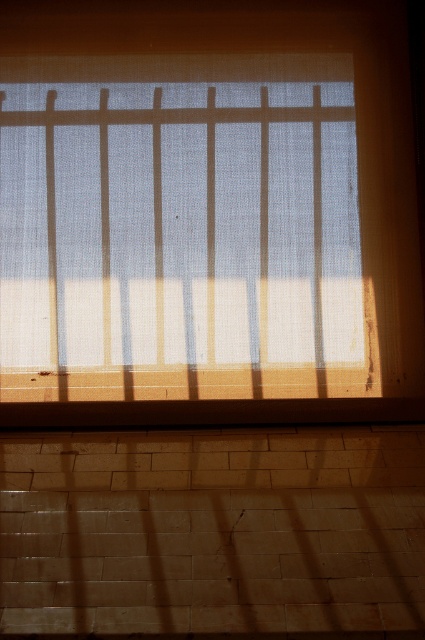
Question: In this image, where is white sheer fabric at center located relative to brown wood at bottom?

Choices:
 (A) above
 (B) below

Answer: (A)

Question: Which of the following is the farthest from the observer?

Choices:
 (A) white sheer fabric at center
 (B) brown wood at bottom

Answer: (A)

Question: Can you confirm if white sheer fabric at center is smaller than brown wood at bottom?

Choices:
 (A) no
 (B) yes

Answer: (A)

Question: Does white sheer fabric at center have a lesser width compared to brown wood at bottom?

Choices:
 (A) no
 (B) yes

Answer: (B)

Question: Which point appears closest to the camera in this image?

Choices:
 (A) (357, 412)
 (B) (314, 212)

Answer: (A)